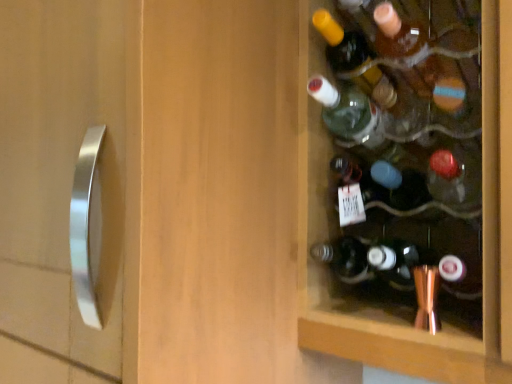
Question: From a real-world perspective, is translucent amber glass bottle at upper right, the 1th bottle in the top-to-bottom sequence, above or below translucent glass bottle at center, which appears as the fourth bottle when viewed from the top?

Choices:
 (A) above
 (B) below

Answer: (A)

Question: Considering their positions, is translucent amber glass bottle at upper right, the fourth bottle from the bottom, located in front of or behind translucent glass bottle at center, placed as the 1th bottle when sorted from bottom to top?

Choices:
 (A) behind
 (B) front

Answer: (A)

Question: Estimate the real-world distances between objects in this image. Which object is farther from the translucent glass bottle at center, which appears as the fourth bottle when viewed from the top?

Choices:
 (A) translucent glass bottle at upper right, arranged as the 2th bottle when viewed from the top
 (B) translucent amber glass bottle at upper right, the 1th bottle in the top-to-bottom sequence
 (C) green glass bottle at upper right, the 2th bottle positioned from the bottom

Answer: (B)

Question: Which object is positioned farthest from the green glass bottle at upper right, acting as the third bottle starting from the top?

Choices:
 (A) translucent glass bottle at upper right, the third bottle ordered from the bottom
 (B) translucent glass bottle at center, placed as the 1th bottle when sorted from bottom to top
 (C) translucent amber glass bottle at upper right, the fourth bottle from the bottom

Answer: (C)